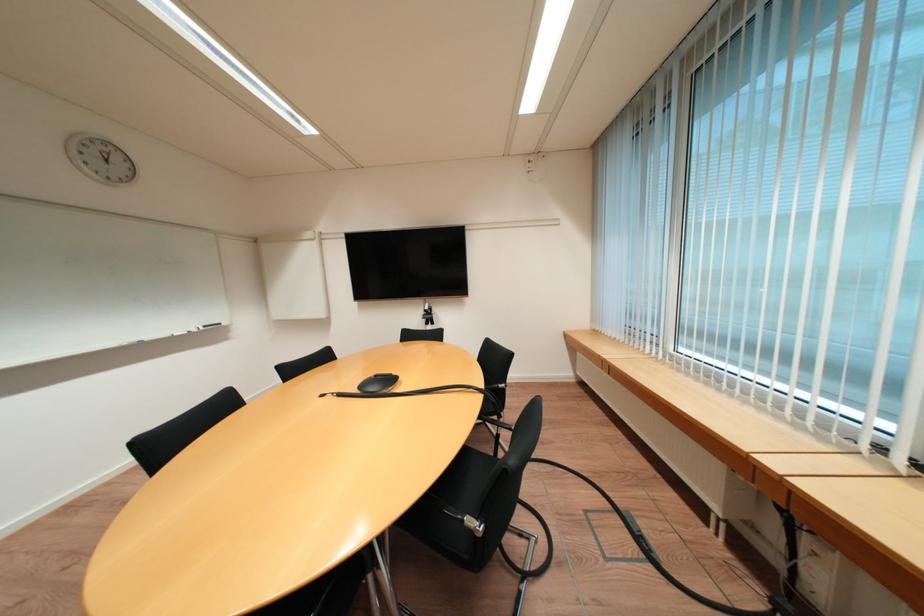
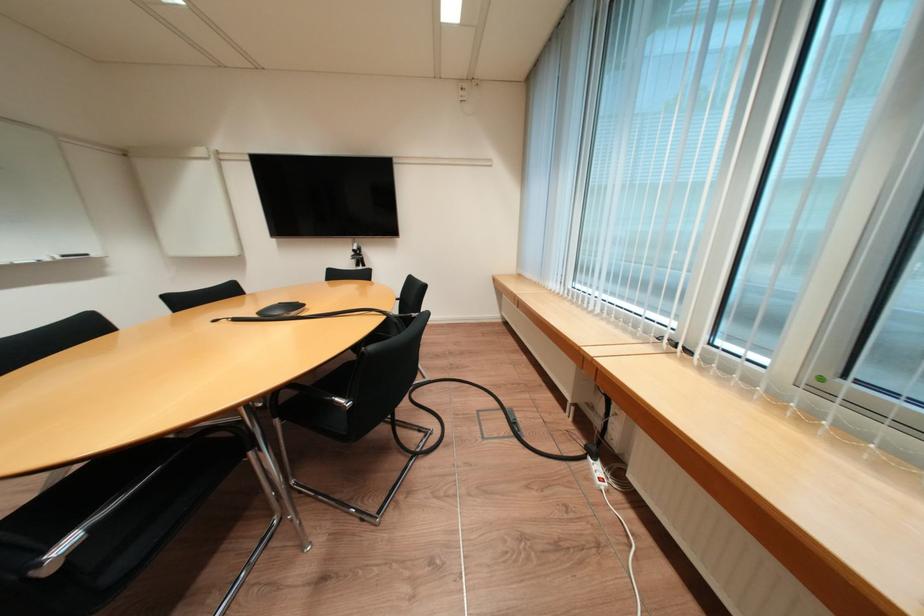
In the second image, find the point that corresponds to (367,392) in the first image.

(265, 318)